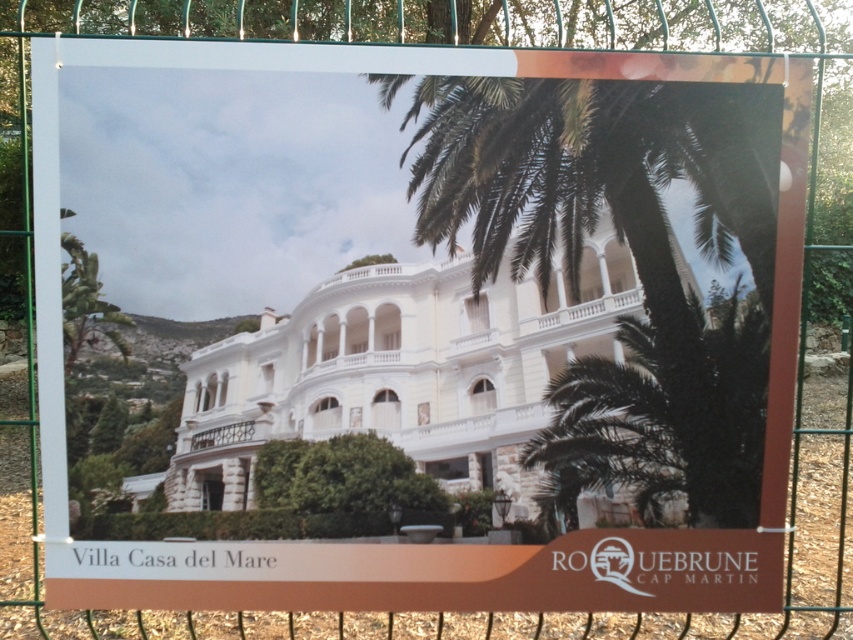
Based on the scene description, where is the green leafy palm tree at upper right located in the poster?

The green leafy palm tree at upper right is located at point (631, 257) in the poster.

You are standing in front of the poster of Villa Casa del Mare. There are two points marked on the poster at coordinates point (x=727, y=166) and point (x=637, y=426). Which point is nearer to you?

Point (x=727, y=166) is closer to the camera than point (x=637, y=426), so the point (x=727, y=166) is nearer to you.